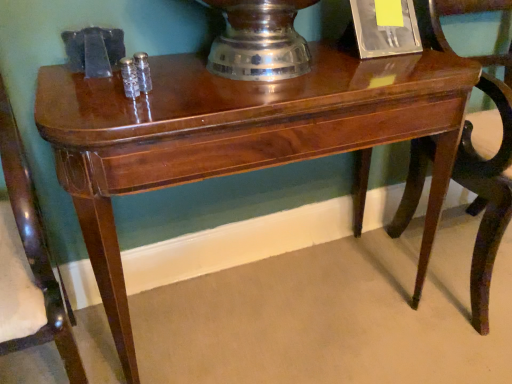
Describe the element at coordinates (28, 262) in the screenshot. I see `mahogany wood chair at left, the first chair from the left` at that location.

Measure the distance between point (8, 336) and camera.

The depth of point (8, 336) is 25.51 inches.

Locate an element on the screen. The width and height of the screenshot is (512, 384). mahogany wood chair at left, which is the 2th chair from right to left is located at coordinates (28, 262).

What do you see at coordinates (487, 179) in the screenshot? The height and width of the screenshot is (384, 512). I see `mahogany wood chair at right, acting as the first chair starting from the right` at bounding box center [487, 179].

Identify the location of mahogany wood chair at right, arranged as the 2th chair when viewed from the left. This screenshot has height=384, width=512. tap(487, 179).

At what (x,y) coordinates should I click in order to perform the action: click on mahogany wood chair at left, which is the 2th chair from right to left. Please return your answer as a coordinate pair (x, y). Image resolution: width=512 pixels, height=384 pixels. Looking at the image, I should click on 28,262.

Considering the positions of objects mahogany wood chair at left, which is the 2th chair from right to left, and mahogany wood chair at right, arranged as the 2th chair when viewed from the left, in the image provided, who is more to the left, mahogany wood chair at left, which is the 2th chair from right to left, or mahogany wood chair at right, arranged as the 2th chair when viewed from the left,?

mahogany wood chair at left, which is the 2th chair from right to left, is more to the left.

Does mahogany wood chair at left, which is the 2th chair from right to left, lie in front of mahogany wood chair at right, acting as the first chair starting from the right?

Yes, the depth of mahogany wood chair at left, which is the 2th chair from right to left, is less than that of mahogany wood chair at right, acting as the first chair starting from the right.

Does point (22, 227) appear closer or farther from the camera than point (467, 186)?

Point (22, 227) is positioned closer to the camera compared to point (467, 186).

From the image's perspective, which one is positioned higher, mahogany wood chair at left, the first chair from the left, or mahogany wood chair at right, arranged as the 2th chair when viewed from the left?

mahogany wood chair at right, arranged as the 2th chair when viewed from the left, from the image's perspective.

Based on the photo, from a real-world perspective, which is physically below, mahogany wood chair at left, the first chair from the left, or mahogany wood chair at right, acting as the first chair starting from the right?

mahogany wood chair at right, acting as the first chair starting from the right, from a real-world perspective.

Can you confirm if mahogany wood chair at left, the first chair from the left, is wider than mahogany wood chair at right, acting as the first chair starting from the right?

In fact, mahogany wood chair at left, the first chair from the left, might be narrower than mahogany wood chair at right, acting as the first chair starting from the right.

Considering the relative sizes of mahogany wood chair at left, which is the 2th chair from right to left, and mahogany wood chair at right, acting as the first chair starting from the right, in the image provided, is mahogany wood chair at left, which is the 2th chair from right to left, shorter than mahogany wood chair at right, acting as the first chair starting from the right,?

In fact, mahogany wood chair at left, which is the 2th chair from right to left, may be taller than mahogany wood chair at right, acting as the first chair starting from the right.

Does mahogany wood chair at left, the first chair from the left, have a smaller size compared to mahogany wood chair at right, acting as the first chair starting from the right?

Yes.

Is mahogany wood chair at left, which is the 2th chair from right to left, positioned beyond the bounds of mahogany wood chair at right, arranged as the 2th chair when viewed from the left?

mahogany wood chair at left, which is the 2th chair from right to left, is positioned outside mahogany wood chair at right, arranged as the 2th chair when viewed from the left.

Is mahogany wood chair at left, which is the 2th chair from right to left, not close to mahogany wood chair at right, acting as the first chair starting from the right?

mahogany wood chair at left, which is the 2th chair from right to left, is far away from mahogany wood chair at right, acting as the first chair starting from the right.

Could you tell me if mahogany wood chair at left, which is the 2th chair from right to left, is facing mahogany wood chair at right, acting as the first chair starting from the right?

No, mahogany wood chair at left, which is the 2th chair from right to left, is not aimed at mahogany wood chair at right, acting as the first chair starting from the right.

How far apart are mahogany wood chair at left, which is the 2th chair from right to left, and mahogany wood chair at right, arranged as the 2th chair when viewed from the left?

A distance of 3.32 feet exists between mahogany wood chair at left, which is the 2th chair from right to left, and mahogany wood chair at right, arranged as the 2th chair when viewed from the left.

Where is `chair located above the mahogany wood chair at left, the first chair from the left (from the image's perspective)`? The image size is (512, 384). chair located above the mahogany wood chair at left, the first chair from the left (from the image's perspective) is located at coordinates (487, 179).

Between mahogany wood chair at right, arranged as the 2th chair when viewed from the left, and mahogany wood chair at left, which is the 2th chair from right to left, which one appears on the right side from the viewer's perspective?

From the viewer's perspective, mahogany wood chair at right, arranged as the 2th chair when viewed from the left, appears more on the right side.

Who is more distant, mahogany wood chair at right, arranged as the 2th chair when viewed from the left, or mahogany wood chair at left, which is the 2th chair from right to left?

Positioned behind is mahogany wood chair at right, arranged as the 2th chair when viewed from the left.

Does point (459, 176) come in front of point (35, 288)?

No, (459, 176) is behind (35, 288).

From the image's perspective, which object appears higher, mahogany wood chair at right, acting as the first chair starting from the right, or mahogany wood chair at left, which is the 2th chair from right to left?

From the image's view, mahogany wood chair at right, acting as the first chair starting from the right, is above.

From a real-world perspective, is mahogany wood chair at right, acting as the first chair starting from the right, positioned under mahogany wood chair at left, which is the 2th chair from right to left, based on gravity?

Yes.

Looking at their sizes, would you say mahogany wood chair at right, arranged as the 2th chair when viewed from the left, is wider or thinner than mahogany wood chair at left, which is the 2th chair from right to left?

In the image, mahogany wood chair at right, arranged as the 2th chair when viewed from the left, appears to be wider than mahogany wood chair at left, which is the 2th chair from right to left.

Which of these two, mahogany wood chair at right, arranged as the 2th chair when viewed from the left, or mahogany wood chair at left, which is the 2th chair from right to left, stands shorter?

mahogany wood chair at right, arranged as the 2th chair when viewed from the left.

Which of these two, mahogany wood chair at right, arranged as the 2th chair when viewed from the left, or mahogany wood chair at left, which is the 2th chair from right to left, is smaller?

Smaller between the two is mahogany wood chair at left, which is the 2th chair from right to left.

Choose the correct answer: Is mahogany wood chair at right, arranged as the 2th chair when viewed from the left, inside mahogany wood chair at left, the first chair from the left, or outside it?

The correct answer is: outside.

Is mahogany wood chair at right, arranged as the 2th chair when viewed from the left, far from mahogany wood chair at left, which is the 2th chair from right to left?

Absolutely, mahogany wood chair at right, arranged as the 2th chair when viewed from the left, is distant from mahogany wood chair at left, which is the 2th chair from right to left.

Could you tell me if mahogany wood chair at right, arranged as the 2th chair when viewed from the left, is turned towards mahogany wood chair at left, which is the 2th chair from right to left?

No, mahogany wood chair at right, arranged as the 2th chair when viewed from the left, is not turned towards mahogany wood chair at left, which is the 2th chair from right to left.

How different are the orientations of mahogany wood chair at right, arranged as the 2th chair when viewed from the left, and mahogany wood chair at left, which is the 2th chair from right to left, in degrees?

There is a 0.777-degree angle between the facing directions of mahogany wood chair at right, arranged as the 2th chair when viewed from the left, and mahogany wood chair at left, which is the 2th chair from right to left.

Image resolution: width=512 pixels, height=384 pixels. I want to click on chair that appears in front of the mahogany wood chair at right, arranged as the 2th chair when viewed from the left, so click(28, 262).

I want to click on chair above the mahogany wood chair at right, acting as the first chair starting from the right (from a real-world perspective), so click(28, 262).

The width and height of the screenshot is (512, 384). What are the coordinates of `chair below the mahogany wood chair at left, which is the 2th chair from right to left (from a real-world perspective)` in the screenshot? It's located at (487, 179).